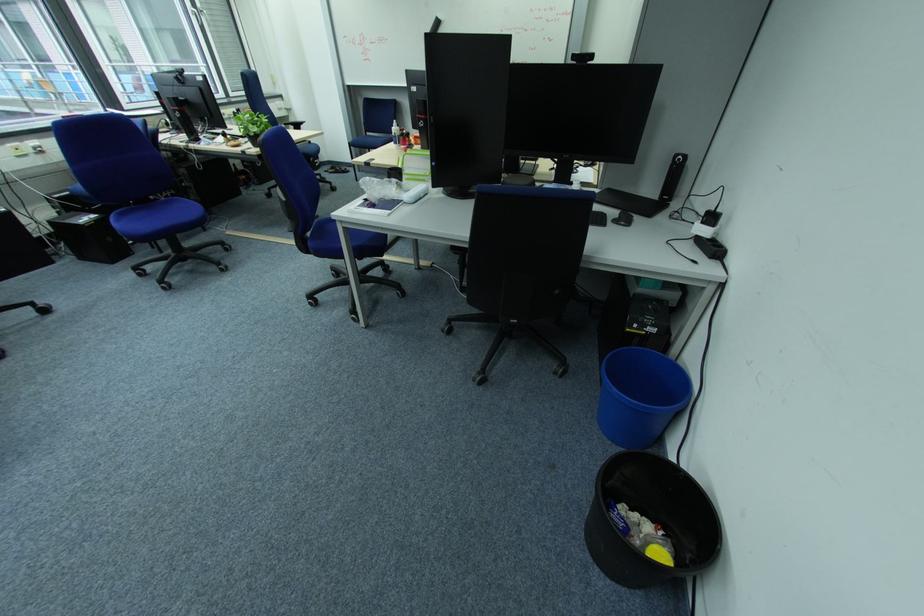
The height and width of the screenshot is (616, 924). Identify the location of blue chair sitting surface. (157, 208).